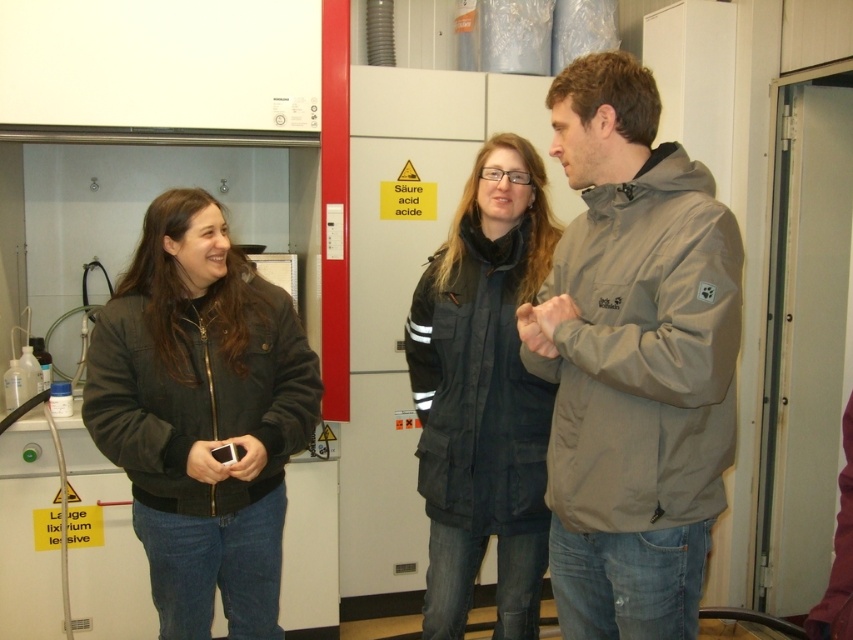
You are a fashion designer observing the jackets worn by the two women in the laboratory. Which jacket, the matte black jacket at left or the black puffy jacket at center, is closer to the ground?

The matte black jacket at left is closer to the ground because it is positioned under the black puffy jacket at center.

You are a fashion designer observing the two jackets in the center of the image. Which jacket, the gray matte jacket at center or the black puffy jacket at center, is shorter in height?

The gray matte jacket at center is shorter in height compared to the black puffy jacket at center.